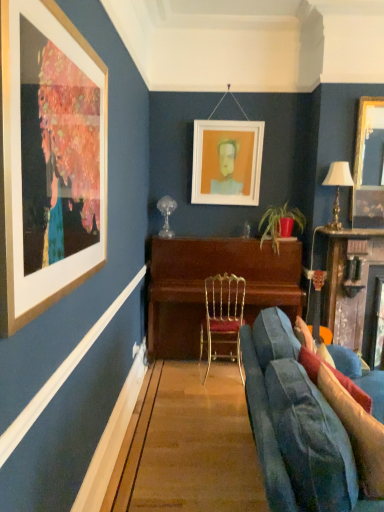
Question: Considering the relative sizes of matte white picture frame at center, the 2th picture frame from the front, and gold metallic table lamp at right in the image provided, is matte white picture frame at center, the 2th picture frame from the front, shorter than gold metallic table lamp at right?

Choices:
 (A) no
 (B) yes

Answer: (A)

Question: Considering the relative sizes of matte white picture frame at center, which is counted as the 1th picture frame, starting from the back, and gold metallic table lamp at right in the image provided, is matte white picture frame at center, which is counted as the 1th picture frame, starting from the back, thinner than gold metallic table lamp at right?

Choices:
 (A) yes
 (B) no

Answer: (A)

Question: Can you confirm if matte white picture frame at center, the 2th picture frame in the right-to-left sequence, is wider than gold metallic table lamp at right?

Choices:
 (A) no
 (B) yes

Answer: (A)

Question: Are matte white picture frame at center, the 2th picture frame from the front, and gold metallic table lamp at right making contact?

Choices:
 (A) yes
 (B) no

Answer: (B)

Question: Is matte white picture frame at center, the 2th picture frame in the right-to-left sequence, at the right side of gold metallic table lamp at right?

Choices:
 (A) yes
 (B) no

Answer: (B)

Question: Does matte white picture frame at center, which is counted as the 1th picture frame, starting from the back, have a larger size compared to gold metallic table lamp at right?

Choices:
 (A) yes
 (B) no

Answer: (A)

Question: Considering the relative sizes of wooden piano at center and gold-framed mirror at upper right, placed as the second picture frame when sorted from back to front, in the image provided, is wooden piano at center smaller than gold-framed mirror at upper right, placed as the second picture frame when sorted from back to front,?

Choices:
 (A) no
 (B) yes

Answer: (A)

Question: Is wooden piano at center looking in the opposite direction of gold-framed mirror at upper right, the 1th picture frame positioned from the front?

Choices:
 (A) no
 (B) yes

Answer: (A)

Question: Is gold-framed mirror at upper right, which is counted as the second picture frame, starting from the left, completely or partially inside wooden piano at center?

Choices:
 (A) yes
 (B) no

Answer: (B)

Question: From a real-world perspective, is wooden piano at center under gold-framed mirror at upper right, placed as the second picture frame when sorted from back to front?

Choices:
 (A) yes
 (B) no

Answer: (A)

Question: Does wooden piano at center appear on the left side of gold-framed mirror at upper right, which is counted as the second picture frame, starting from the left?

Choices:
 (A) yes
 (B) no

Answer: (A)

Question: Is wooden piano at center behind gold-framed mirror at upper right, placed as the second picture frame when sorted from back to front?

Choices:
 (A) yes
 (B) no

Answer: (A)

Question: Is velvet red pillow at lower right, which is the 1th pillow in back-to-front order, smaller than matte white picture frame at center, which is counted as the 1th picture frame, starting from the back?

Choices:
 (A) yes
 (B) no

Answer: (A)